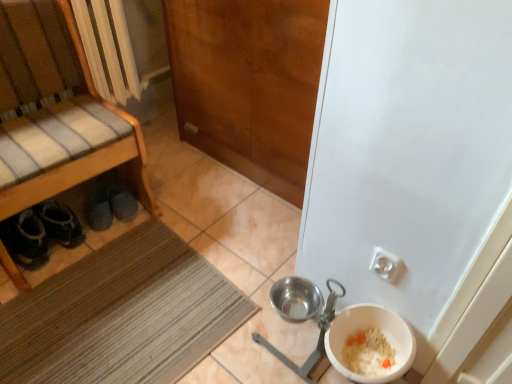
The height and width of the screenshot is (384, 512). I want to click on vacant area that is in front of wooden door at center, so click(216, 238).